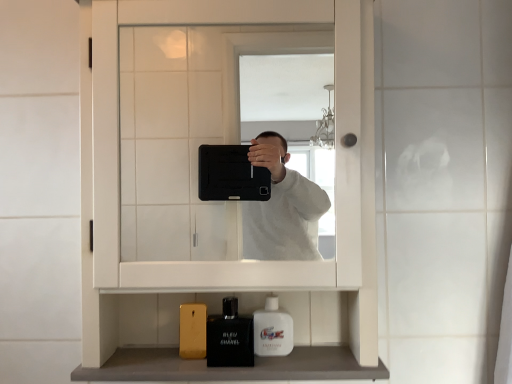
At what (x,y) coordinates should I click in order to perform the action: click on free region on the left part of matte black perfume at lower center. Please return your answer as a coordinate pair (x, y). This screenshot has height=384, width=512. Looking at the image, I should click on coord(158,359).